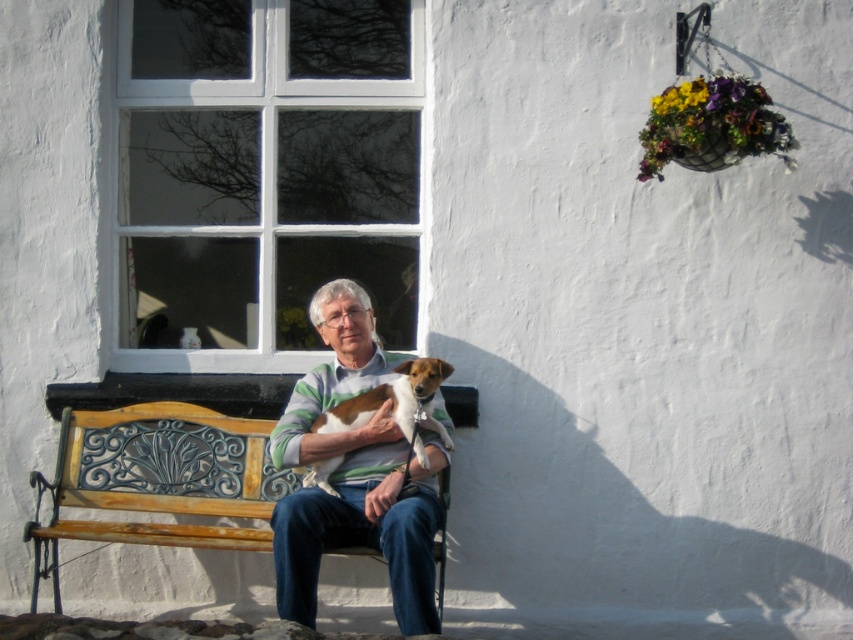
You are a photographer trying to capture the striped sweater at center and the brown and white fur at center in the same frame. Based on their sizes, which object should you focus on first to ensure both are in focus?

The striped sweater at center is much taller than the brown and white fur at center, so focusing on the taller striped sweater at center first will help ensure both are in focus.

You are a fashion designer observing the striped sweater at center and the brown and white fur at center in the image. Which item takes up more visual space in the scene?

The striped sweater at center is larger in size than the brown and white fur at center, so it occupies more visual space in the scene.